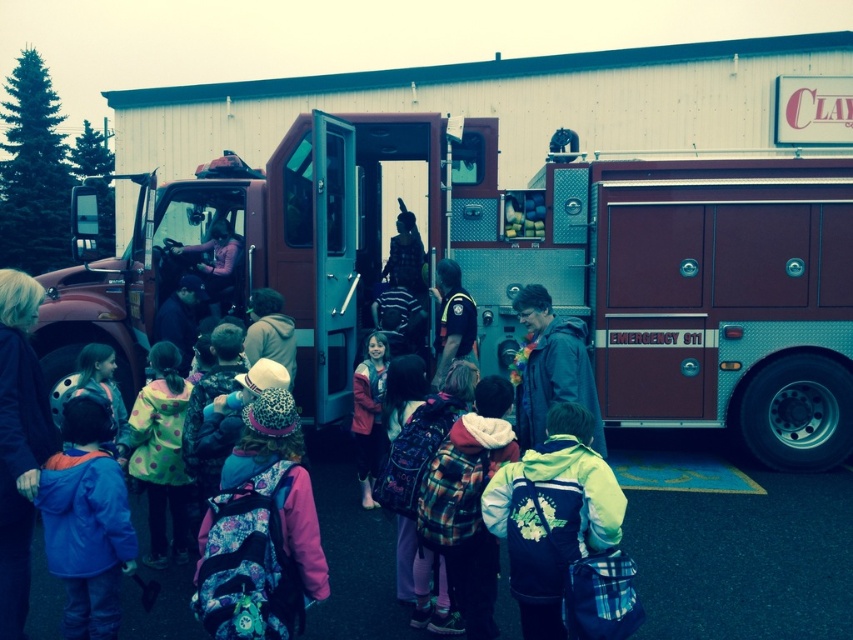
Identify the location of dark blue jacket at center. (552, 369).

The width and height of the screenshot is (853, 640). I want to click on dark blue jacket at center, so click(552, 369).

Is maroon metallic fire truck at center thinner than polka dot fabric jacket at center?

No, maroon metallic fire truck at center is not thinner than polka dot fabric jacket at center.

Can you confirm if maroon metallic fire truck at center is positioned below polka dot fabric jacket at center?

No, maroon metallic fire truck at center is not below polka dot fabric jacket at center.

What are the coordinates of `maroon metallic fire truck at center` in the screenshot? It's located at (527, 272).

Is point (107, 451) closer to viewer compared to point (595, 440)?

Yes, point (107, 451) is in front of point (595, 440).

Image resolution: width=853 pixels, height=640 pixels. I want to click on blue fleece jacket at lower left, so click(x=86, y=520).